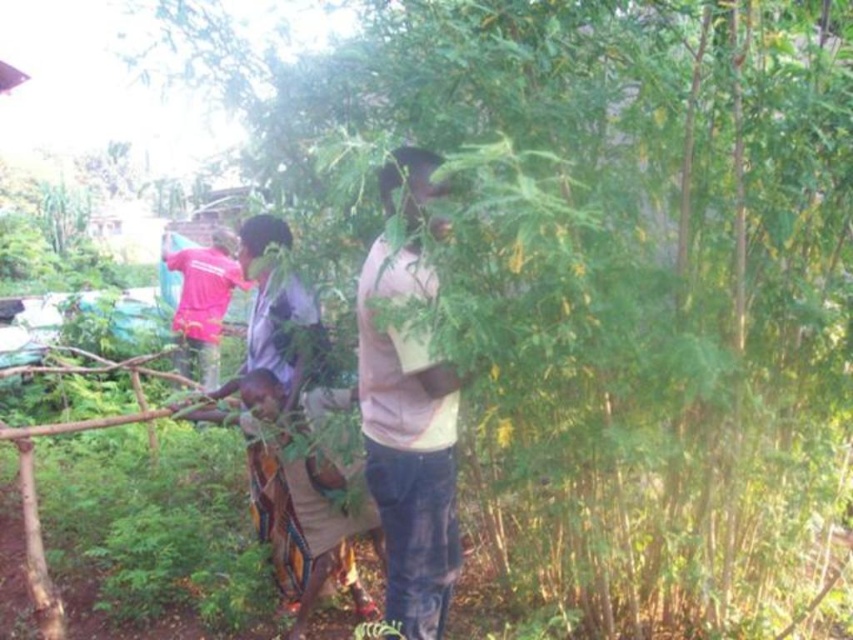
Is pink cotton shirt at center taller than pink fabric at upper left?

No, pink cotton shirt at center is not taller than pink fabric at upper left.

Can you confirm if pink cotton shirt at center is positioned below pink fabric at upper left?

Indeed, pink cotton shirt at center is positioned under pink fabric at upper left.

Is point (358, 365) closer to camera compared to point (177, 326)?

That is True.

Locate an element on the screen. The width and height of the screenshot is (853, 640). pink cotton shirt at center is located at coordinates (408, 445).